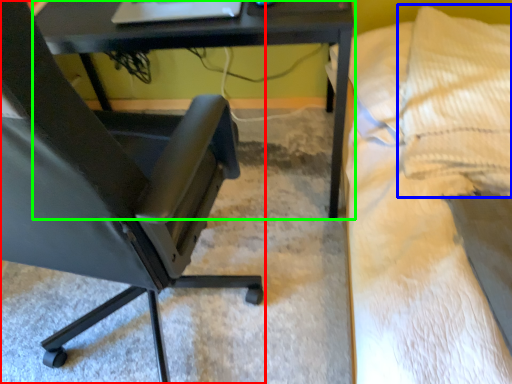
Question: Based on their relative distances, which object is nearer to chair (highlighted by a red box)? Choose from pillow (highlighted by a blue box) and table (highlighted by a green box).

Choices:
 (A) pillow
 (B) table

Answer: (B)